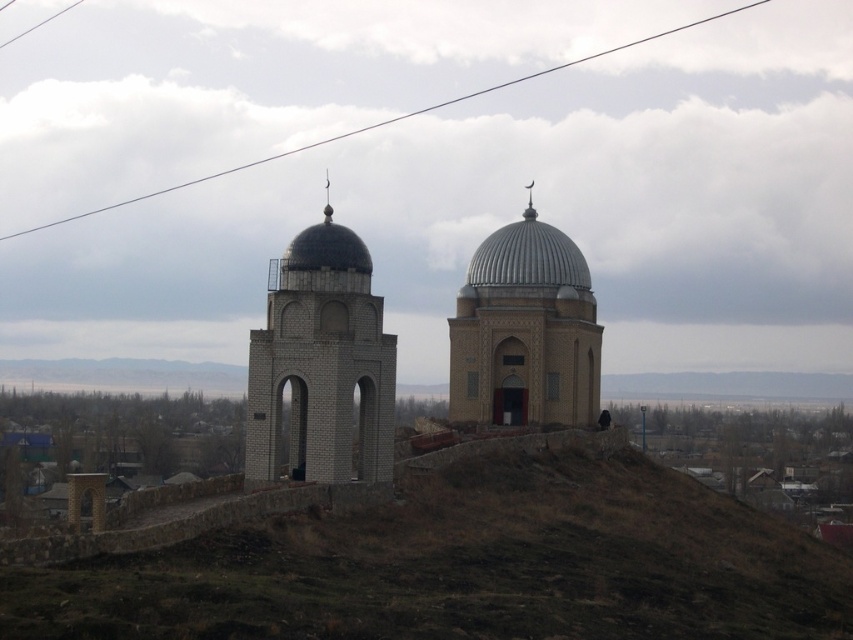
In the scene shown: You are standing at point (467, 566) in the image. Looking around, you see two domed structures. Which direction should you walk to reach the taller domed structure?

The point (467, 566) is located at the brown grassy hillside at center. The taller domed structure is on the left side, so you should walk towards the left direction to reach it.

You are standing at the base of the hill looking up at the two domed structures. You want to take a photo that includes both the silver metallic dome at center and the dark dome with a small pointed spire. Where should you position yourself to ensure both are in the frame?

Since the silver metallic dome at center is located at point [525,330], you should position yourself centrally at the base of the hill to capture both the silver metallic dome at center and the dark dome with a small pointed spire in your photo.

You are an architect examining the two domed structures on the hill. Which dome, the metallic ribbed dome at center or the matte white dome at center, is located to the right when viewed from the base of the hill?

The metallic ribbed dome at center is positioned on the right side of the matte white dome at center, so when viewed from the base of the hill, the metallic ribbed dome at center is to the right of the matte white dome at center.